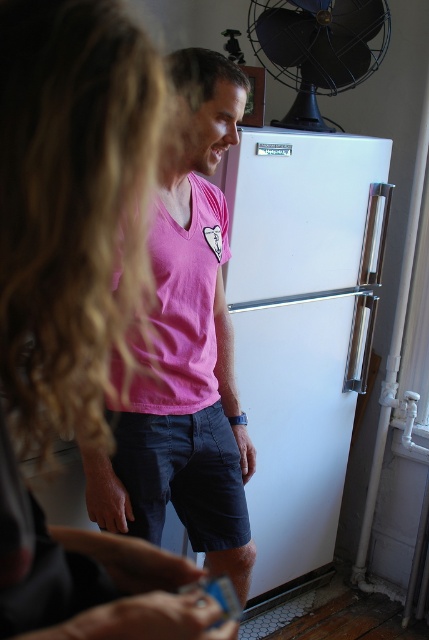
You are trying to fit a new appliance that is 1.5 meters wide into the space next to the white matte refrigerator at right and the pink cotton shirt at center. Based on their sizes, can the appliance fit between them?

The white matte refrigerator at right is wider than the pink cotton shirt at center. However, without knowing the exact distance between them or the total available space, it is impossible to determine if the 1.5 meter wide appliance can fit between them.

You are trying to determine if the blonde hair at upper left can fit entirely within the width of the white matte refrigerator at right. Based on the scene, can it?

The blonde hair at upper left has a width less than the white matte refrigerator at right, so yes, the blonde hair at upper left can fit entirely within the width of the white matte refrigerator at right.

You are trying to determine the relative sizes of the objects in the scene. Which object is smaller between the blonde hair at upper left and the white matte refrigerator at right?

The blonde hair at upper left is smaller than the white matte refrigerator at right.